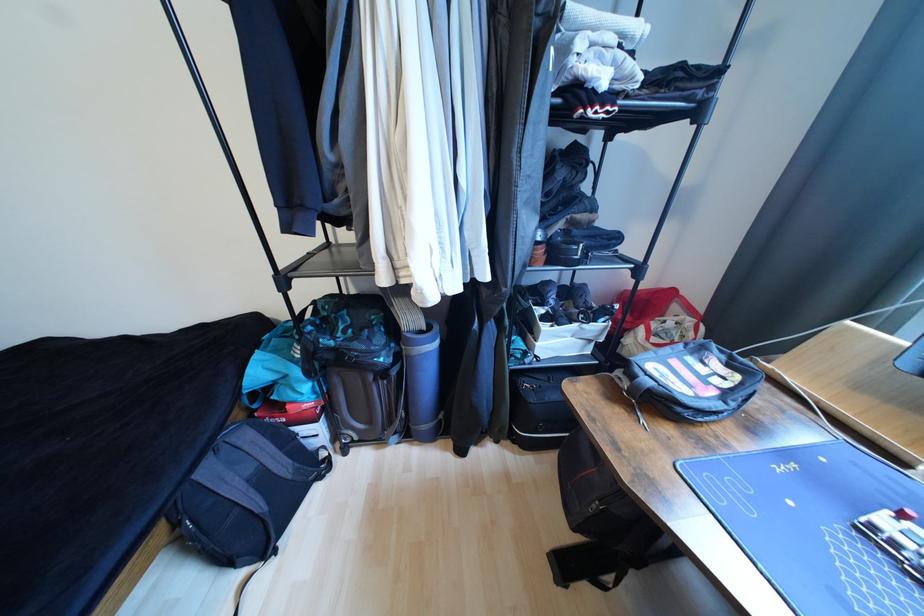
Where would you pull the suitcase handle? Please return your answer as a coordinate pair (x, y).

(246, 492)